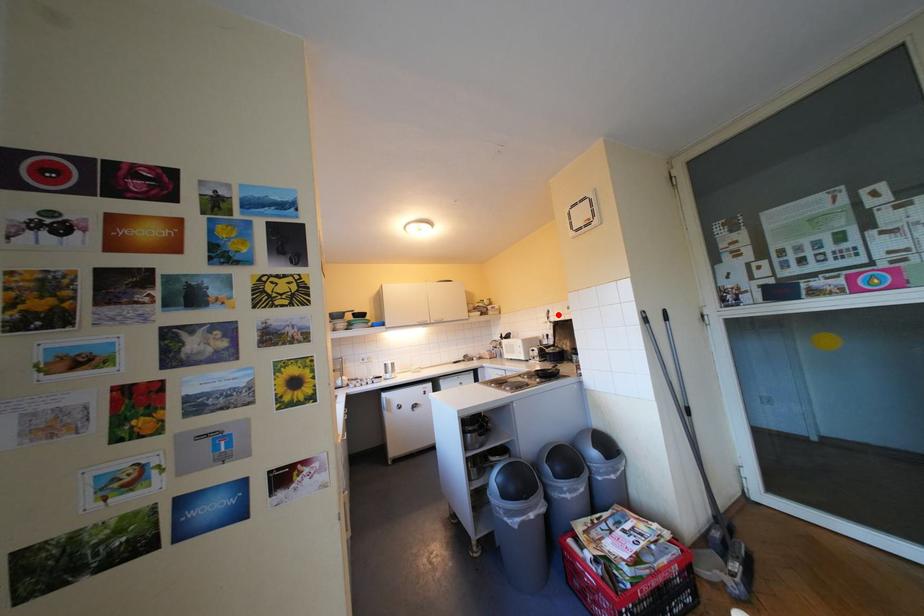
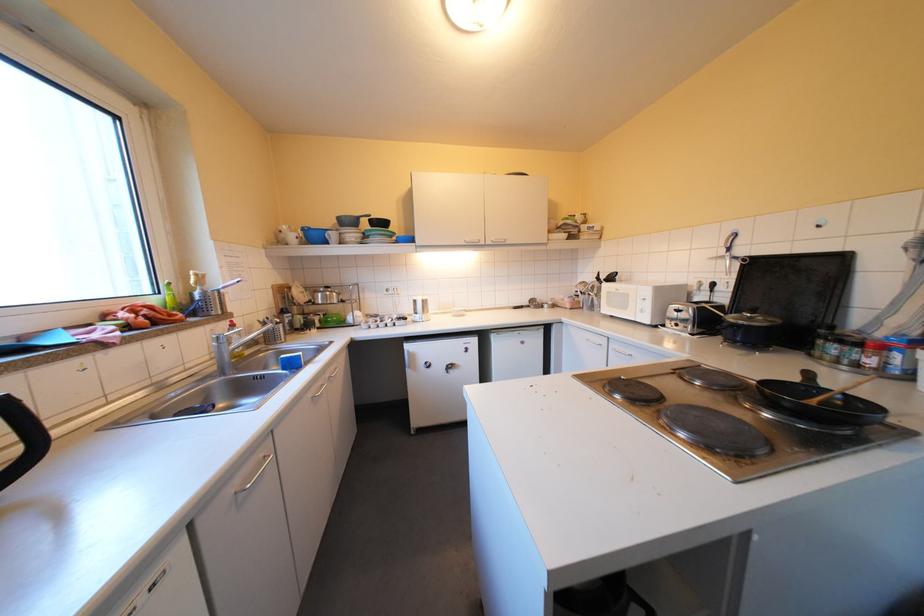
In the second image, find the point that corresponds to the highlighted location in the first image.

(736, 243)